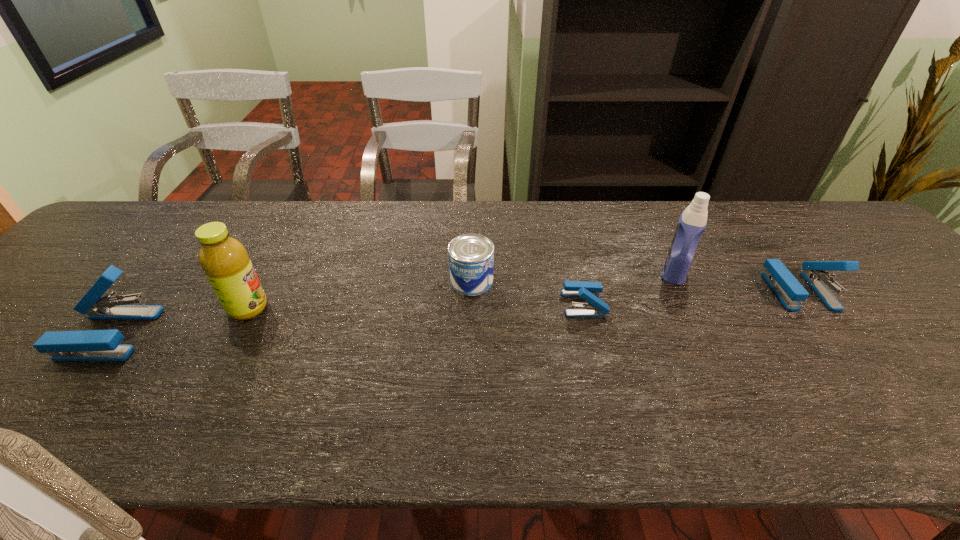
Locate an element on the screen. Image resolution: width=960 pixels, height=540 pixels. object that can be found as the closest to the fruit juice is located at coordinates (89, 345).

Select which stapler is the closest to the fourth object from left to right. Please provide its 2D coordinates. Your answer should be formatted as a tuple, i.e. [(x, y)], where the tuple contains the x and y coordinates of a point satisfying the conditions above.

[(787, 288)]

Choose which stapler is the second nearest neighbor to the leftmost stapler. Please provide its 2D coordinates. Your answer should be formatted as a tuple, i.e. [(x, y)], where the tuple contains the x and y coordinates of a point satisfying the conditions above.

[(787, 288)]

Locate an element on the screen. vacant area that satisfies the following two spatial constraints: 1. on the front label of the third object from left to right; 2. on the right side of the rightmost object is located at coordinates (471, 291).

In order to click on free space that satisfies the following two spatial constraints: 1. on the front label of the can; 2. on the right side of the rightmost stapler in this screenshot , I will do `click(471, 291)`.

At what (x,y) coordinates should I click in order to perform the action: click on vacant area in the image that satisfies the following two spatial constraints: 1. on the back side of the shortest stapler; 2. on the right side of the leftmost stapler. Please return your answer as a coordinate pair (x, y). The image size is (960, 540). Looking at the image, I should click on (132, 303).

The image size is (960, 540). I want to click on vacant space that satisfies the following two spatial constraints: 1. on the front label of the second shortest stapler; 2. on the left side of the can, so click(471, 291).